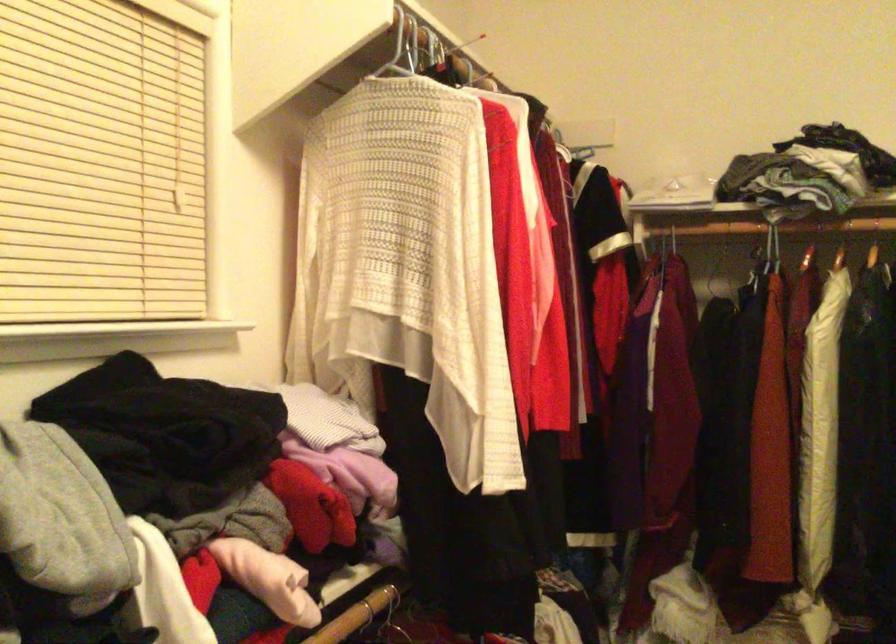
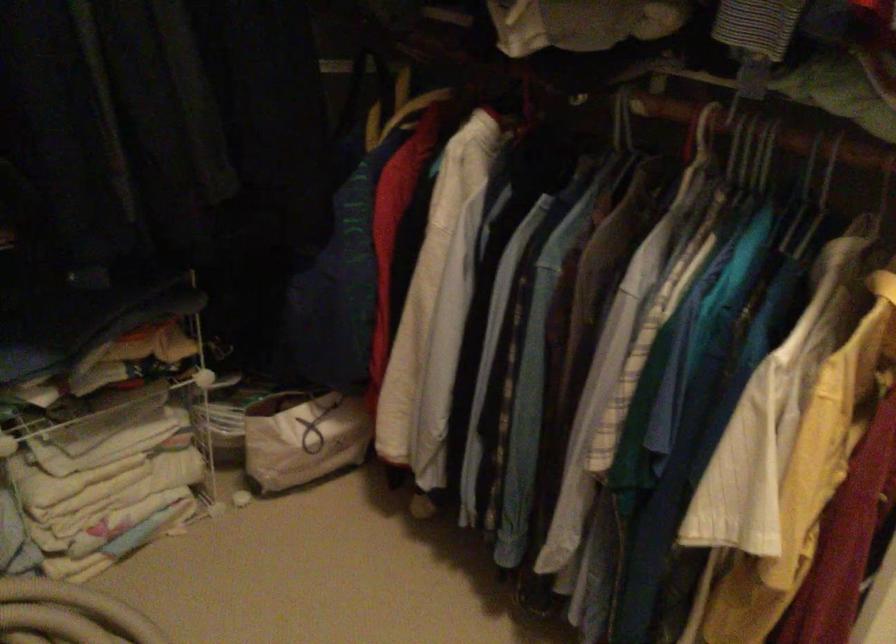
The images are taken continuously from a first-person perspective. In which direction is your viewpoint rotating?

The camera's rotation is toward right-down.